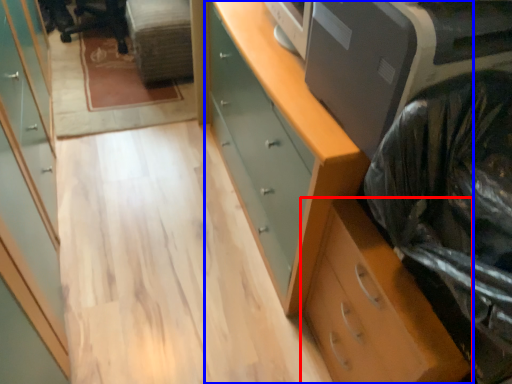
Question: Which of the following is the closest to the observer, chest of drawers (highlighted by a red box) or chest of drawers (highlighted by a blue box)?

Choices:
 (A) chest of drawers
 (B) chest of drawers

Answer: (A)